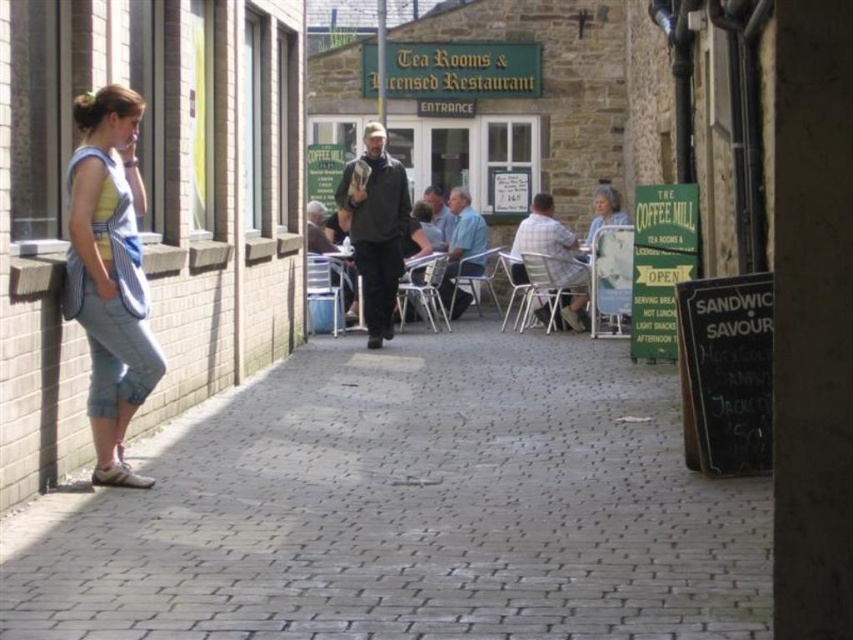
Between denim shorts at left and metallic silver table at center, which one is positioned higher?

denim shorts at left is higher up.

This screenshot has height=640, width=853. Find the location of `denim shorts at left`. denim shorts at left is located at coordinates (109, 273).

Who is more forward, (109, 196) or (426, 278)?

Positioned in front is point (109, 196).

You are a GUI agent. You are given a task and a screenshot of the screen. Output one action in this format:
    pyautogui.click(x=<x>, y=<y>)
    Task: Click on the denim shorts at left
    Image resolution: width=853 pixels, height=640 pixels.
    Given the screenshot: What is the action you would take?
    pyautogui.click(x=109, y=273)

Between dark gray jacket at center and plaid fabric shirt at center, which one is positioned higher?

dark gray jacket at center is higher up.

Does dark gray jacket at center come behind plaid fabric shirt at center?

That is False.

At what (x,y) coordinates should I click in order to perform the action: click on dark gray jacket at center. Please return your answer as a coordinate pair (x, y). This screenshot has width=853, height=640. Looking at the image, I should click on (375, 228).

At what (x,y) coordinates should I click in order to perform the action: click on dark gray jacket at center. Please return your answer as a coordinate pair (x, y). Looking at the image, I should click on (375, 228).

Does gray brick pavement at center appear over dark gray jacket at center?

Incorrect, gray brick pavement at center is not positioned above dark gray jacket at center.

Does gray brick pavement at center have a lesser width compared to dark gray jacket at center?

Yes.

Is point (611, 458) less distant than point (393, 241)?

Yes, point (611, 458) is in front of point (393, 241).

What are the coordinates of `gray brick pavement at center` in the screenshot? It's located at (407, 508).